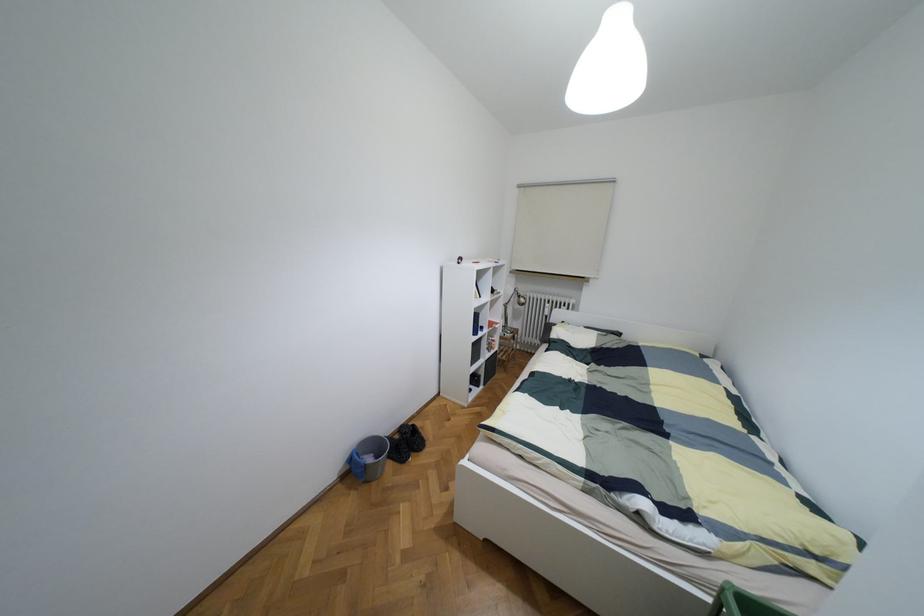
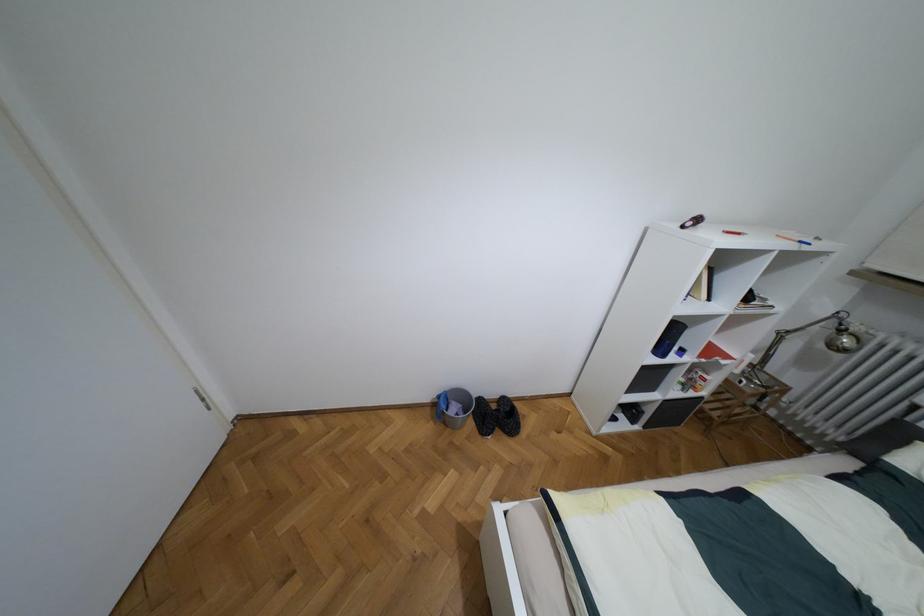
First-person continuous shooting, in which direction is the camera rotating?

The camera rotated toward left-down.